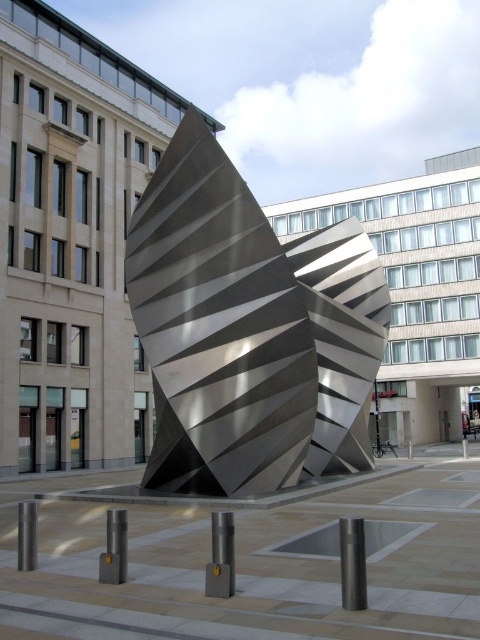
You are standing in the urban plaza and want to take a photo of both the satin silver sculpture at center and the polished silver pole at center. Which object should you focus on first to ensure both are in the frame?

You should focus on the satin silver sculpture at center first because it is closer to you than the polished silver pole at center, ensuring both are in the frame.

You are a city planner assessing the sculpture in the plaza. You need to determine if the polished silver post at center can be seen from the base of the polished metal pole at lower left. Based on their heights and positions, can you confirm visibility?

The polished silver post at center is taller than the polished metal pole at lower left, so yes, the polished silver post at center can be seen from the base of the polished metal pole at lower left since it is taller and likely unobstructed.

You are a maintenance worker needing to reach both the polished silver post at center and the polished metal pole at lower left with a 1.2 meter long tool. Can you reach both objects without moving the tool?

The polished silver post at center is 1.14 meters away from the polished metal pole at lower left. Since the tool is 1.2 meters long, you can reach both objects without moving the tool as the distance between them is within the tool length.